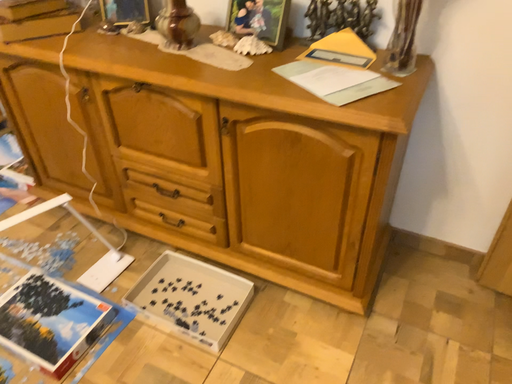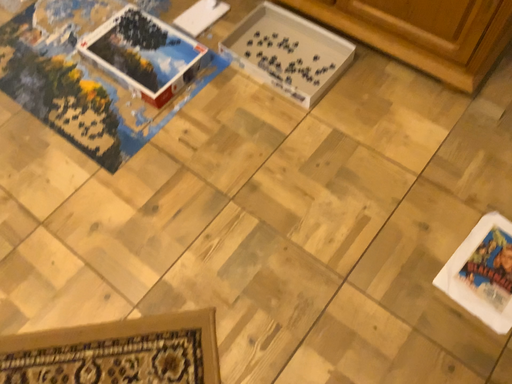
Question: Which way did the camera rotate in the video?

Choices:
 (A) rotated upward
 (B) rotated downward

Answer: (B)